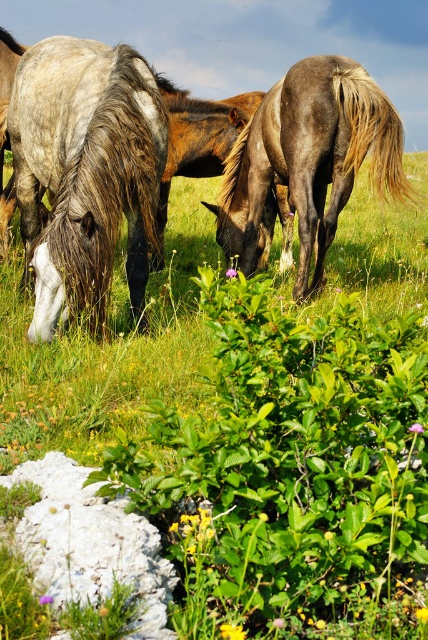
Can you confirm if white glossy horse at center is shorter than white matte horse at left?

No.

Can you confirm if white glossy horse at center is positioned to the right of white matte horse at left?

Yes, white glossy horse at center is to the right of white matte horse at left.

Is point (148, 144) positioned before point (143, 76)?

Yes, point (148, 144) is closer to viewer.

The width and height of the screenshot is (428, 640). I want to click on white glossy horse at center, so click(95, 166).

Can you confirm if white glossy horse at center is shorter than dark brown glossy horse at center?

No, white glossy horse at center is not shorter than dark brown glossy horse at center.

Who is lower down, white glossy horse at center or dark brown glossy horse at center?

white glossy horse at center

This screenshot has height=640, width=428. Identify the location of white glossy horse at center. (95, 166).

Is the position of white matte horse at left less distant than that of dark brown glossy horse at center?

That is True.

Can you confirm if white matte horse at left is positioned to the left of dark brown glossy horse at center?

Indeed, white matte horse at left is positioned on the left side of dark brown glossy horse at center.

In order to click on white matte horse at left in this screenshot , I will do `click(85, 170)`.